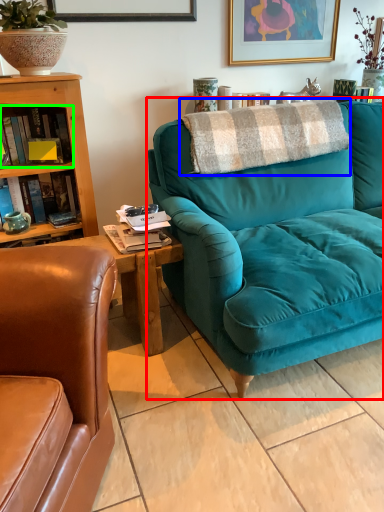
Question: Estimate the real-world distances between objects in this image. Which object is farther from studio couch (highlighted by a red box), blanket (highlighted by a blue box) or book (highlighted by a green box)?

Choices:
 (A) blanket
 (B) book

Answer: (B)